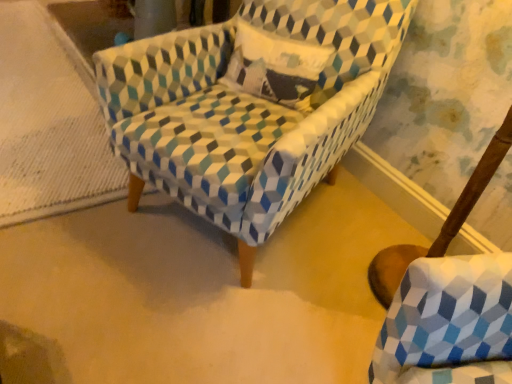
Describe the element at coordinates (443, 224) in the screenshot. I see `textured fabric swivel chair at lower right` at that location.

From the picture: What is the approximate width of textured fabric swivel chair at lower right?

textured fabric swivel chair at lower right is 3.72 centimeters wide.

Image resolution: width=512 pixels, height=384 pixels. Find the location of `textured fabric armchair at center`. textured fabric armchair at center is located at coordinates (246, 111).

Find the location of a particular element. This screenshot has width=512, height=384. textured fabric swivel chair at lower right is located at coordinates (443, 224).

Could you tell me if textured fabric swivel chair at lower right is turned towards textured fabric armchair at center?

Yes, textured fabric swivel chair at lower right is aimed at textured fabric armchair at center.

How different are the orientations of textured fabric swivel chair at lower right and textured fabric armchair at center in degrees?

19.7 degrees separate the facing orientations of textured fabric swivel chair at lower right and textured fabric armchair at center.

Which of these two, textured fabric swivel chair at lower right or textured fabric armchair at center, stands taller?

textured fabric armchair at center is taller.

Can textured fabric armchair at center be found inside textured fabric swivel chair at lower right?

Definitely not — textured fabric armchair at center is not inside textured fabric swivel chair at lower right.

Considering the relative sizes of textured cotton pillow at center and textured fabric armchair at center in the image provided, is textured cotton pillow at center bigger than textured fabric armchair at center?

Incorrect, textured cotton pillow at center is not larger than textured fabric armchair at center.

Is point (243, 46) positioned in front of point (213, 214)?

No, it is behind (213, 214).

From the image's perspective, which is above, textured cotton pillow at center or textured fabric armchair at center?

textured cotton pillow at center appears higher in the image.

Relative to textured fabric armchair at center, is textured cotton pillow at center in front or behind?

Visually, textured cotton pillow at center is located behind textured fabric armchair at center.

How many degrees apart are the facing directions of textured fabric armchair at center and textured fabric swivel chair at lower right?

The angle between the facing direction of textured fabric armchair at center and the facing direction of textured fabric swivel chair at lower right is 19.7 degrees.

Which is behind, point (154, 140) or point (399, 278)?

Positioned behind is point (399, 278).

Considering the relative positions of textured fabric armchair at center and textured fabric swivel chair at lower right in the image provided, is textured fabric armchair at center to the left of textured fabric swivel chair at lower right from the viewer's perspective?

Yes, textured fabric armchair at center is to the left of textured fabric swivel chair at lower right.

Identify the location of chair that is on the left side of textured fabric swivel chair at lower right. This screenshot has height=384, width=512. (246, 111).

Is textured fabric swivel chair at lower right oriented away from textured cotton pillow at center?

That's not correct — textured fabric swivel chair at lower right is not looking away from textured cotton pillow at center.

Is the depth of textured fabric swivel chair at lower right less than that of textured cotton pillow at center?

No, textured fabric swivel chair at lower right is further to the viewer.

From the image's perspective, between textured fabric swivel chair at lower right and textured cotton pillow at center, who is located below?

textured fabric swivel chair at lower right, from the image's perspective.

Which object is positioned more to the right, textured fabric swivel chair at lower right or textured cotton pillow at center?

textured fabric swivel chair at lower right.

Considering the relative sizes of textured cotton pillow at center and textured fabric swivel chair at lower right in the image provided, is textured cotton pillow at center smaller than textured fabric swivel chair at lower right?

Incorrect, textured cotton pillow at center is not smaller in size than textured fabric swivel chair at lower right.

Can you see textured cotton pillow at center touching textured fabric swivel chair at lower right?

textured cotton pillow at center and textured fabric swivel chair at lower right are clearly separated.

Find the location of a particular element. The height and width of the screenshot is (384, 512). swivel chair located below the textured cotton pillow at center (from the image's perspective) is located at coordinates (443, 224).

Which is in front, point (312, 57) or point (374, 258)?

The point (312, 57) is closer.

Considering the positions of point (362, 13) and point (297, 92), is point (362, 13) closer or farther from the camera than point (297, 92)?

Point (362, 13).

Would you say textured fabric armchair at center is a long distance from textured cotton pillow at center?

They are positioned close to each other.

Where is `chair that is under the textured cotton pillow at center (from a real-world perspective)`? chair that is under the textured cotton pillow at center (from a real-world perspective) is located at coordinates (246, 111).

Does textured fabric armchair at center have a greater width compared to textured cotton pillow at center?

Yes, textured fabric armchair at center is wider than textured cotton pillow at center.

The height and width of the screenshot is (384, 512). Find the location of `chair above the textured fabric swivel chair at lower right (from the image's perspective)`. chair above the textured fabric swivel chair at lower right (from the image's perspective) is located at coordinates (246, 111).

Where is `chair in front of the textured cotton pillow at center`? The height and width of the screenshot is (384, 512). chair in front of the textured cotton pillow at center is located at coordinates (246, 111).

From the image, which object appears to be farther from textured fabric swivel chair at lower right, textured fabric armchair at center or textured cotton pillow at center?

textured cotton pillow at center.

Estimate the real-world distances between objects in this image. Which object is further from textured fabric armchair at center, textured cotton pillow at center or textured fabric swivel chair at lower right?

Among the two, textured fabric swivel chair at lower right is located further to textured fabric armchair at center.

Considering their positions, is textured fabric swivel chair at lower right positioned further to textured fabric armchair at center than textured cotton pillow at center?

textured fabric swivel chair at lower right lies further to textured fabric armchair at center than the other object.

Based on their spatial positions, is textured fabric swivel chair at lower right or textured fabric armchair at center closer to textured cotton pillow at center?

textured fabric armchair at center is positioned closer to the anchor textured cotton pillow at center.

Estimate the real-world distances between objects in this image. Which object is closer to textured cotton pillow at center, textured fabric armchair at center or textured fabric swivel chair at lower right?

textured fabric armchair at center lies closer to textured cotton pillow at center than the other object.

Looking at this image, when comparing their distances from textured fabric swivel chair at lower right, does textured cotton pillow at center or textured fabric armchair at center seem further?

textured cotton pillow at center.

You are a GUI agent. You are given a task and a screenshot of the screen. Output one action in this format:
    pyautogui.click(x=<x>, y=<y>)
    Task: Click on the throw pillow located between textured fabric armchair at center and textured fabric swivel chair at lower right in the depth direction
    
    Given the screenshot: What is the action you would take?
    pyautogui.click(x=275, y=66)